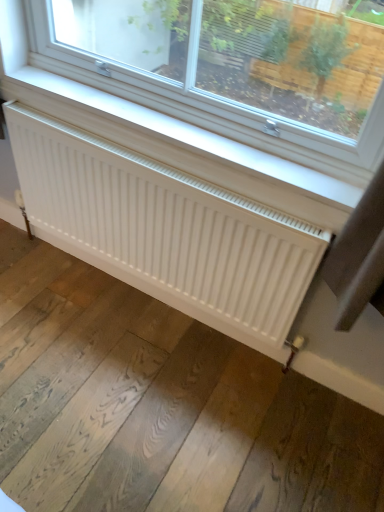
Measure the distance between white matte radiator at lower center and camera.

The distance of white matte radiator at lower center from camera is 3.60 feet.

Identify the location of white matte radiator at lower center. The height and width of the screenshot is (512, 384). (166, 230).

The width and height of the screenshot is (384, 512). What do you see at coordinates (166, 230) in the screenshot?
I see `white matte radiator at lower center` at bounding box center [166, 230].

Locate an element on the screen. white matte radiator at lower center is located at coordinates (166, 230).